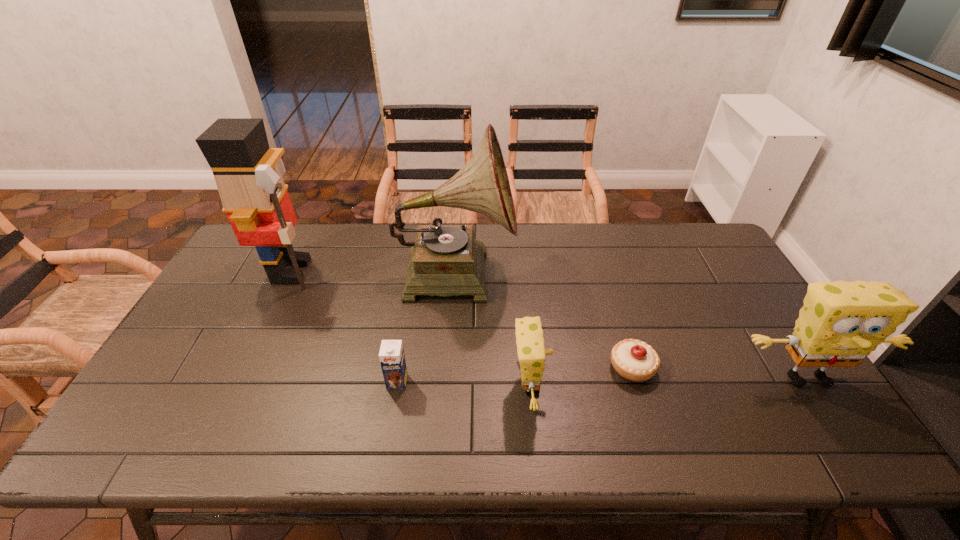
Where is `unoccupied area between the second shortest object and the second object from right to left`? Image resolution: width=960 pixels, height=540 pixels. unoccupied area between the second shortest object and the second object from right to left is located at coordinates (515, 374).

You are a GUI agent. You are given a task and a screenshot of the screen. Output one action in this format:
    pyautogui.click(x=<x>, y=<y>)
    Task: Click on the free space between the record player and the nutcracker
    This screenshot has height=540, width=960.
    Given the screenshot: What is the action you would take?
    pyautogui.click(x=373, y=271)

I want to click on unoccupied position between the leftmost object and the chocolate milk, so (345, 326).

Identify the location of vacant region between the chocolate milk and the taller sponge. (602, 380).

Where is `vacant space in between the shortest object and the rightmost object`? This screenshot has width=960, height=540. vacant space in between the shortest object and the rightmost object is located at coordinates (719, 373).

The image size is (960, 540). Identify the location of unoccupied area between the shortest object and the fifth tallest object. (515, 374).

The height and width of the screenshot is (540, 960). Identify the location of free space between the fifth tallest object and the second object from right to left. (515, 374).

Identify the location of empty space that is in between the pastry and the record player. (543, 319).

Where is `object that stands as the fifth closest to the pastry`? object that stands as the fifth closest to the pastry is located at coordinates (255, 198).

Find the location of a particular element. Image resolution: width=960 pixels, height=540 pixels. object that is the second closest to the second object from right to left is located at coordinates (841, 323).